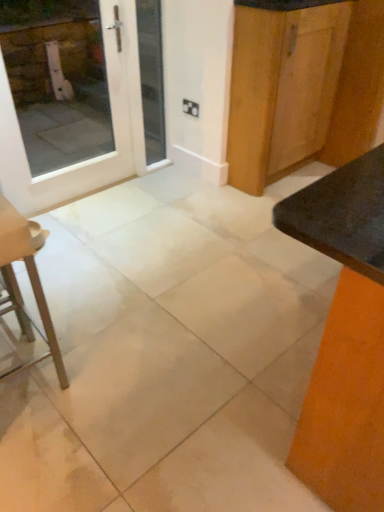
Question: From a real-world perspective, is white glossy door at upper left on matte black table at right?

Choices:
 (A) yes
 (B) no

Answer: (A)

Question: Is the surface of white glossy door at upper left in direct contact with matte black table at right?

Choices:
 (A) yes
 (B) no

Answer: (B)

Question: From the image's perspective, is white glossy door at upper left above matte black table at right?

Choices:
 (A) no
 (B) yes

Answer: (B)

Question: From a real-world perspective, does white glossy door at upper left sit lower than matte black table at right?

Choices:
 (A) yes
 (B) no

Answer: (B)

Question: Can you confirm if white glossy door at upper left is taller than matte black table at right?

Choices:
 (A) no
 (B) yes

Answer: (B)

Question: Based on their sizes in the image, would you say white glossy door at upper left is bigger or smaller than white glass door at upper left?

Choices:
 (A) big
 (B) small

Answer: (A)

Question: From the image's perspective, is white glossy door at upper left located above or below white glass door at upper left?

Choices:
 (A) above
 (B) below

Answer: (B)

Question: From a real-world perspective, is white glossy door at upper left above or below white glass door at upper left?

Choices:
 (A) below
 (B) above

Answer: (B)

Question: Looking at their shapes, would you say white glossy door at upper left is wider or thinner than white glass door at upper left?

Choices:
 (A) wide
 (B) thin

Answer: (B)

Question: Is white tile floor at center taller or shorter than wooden cabinet at upper right?

Choices:
 (A) tall
 (B) short

Answer: (B)

Question: Is white tile floor at center bigger or smaller than wooden cabinet at upper right?

Choices:
 (A) big
 (B) small

Answer: (A)

Question: In terms of width, does white tile floor at center look wider or thinner when compared to wooden cabinet at upper right?

Choices:
 (A) thin
 (B) wide

Answer: (B)

Question: In the image, is white tile floor at center on the left side or the right side of wooden cabinet at upper right?

Choices:
 (A) left
 (B) right

Answer: (A)

Question: Considering the positions of white tile floor at center and white glass door at upper left in the image, is white tile floor at center bigger or smaller than white glass door at upper left?

Choices:
 (A) big
 (B) small

Answer: (A)

Question: Considering the positions of point (233, 294) and point (162, 62), is point (233, 294) closer or farther from the camera than point (162, 62)?

Choices:
 (A) farther
 (B) closer

Answer: (B)